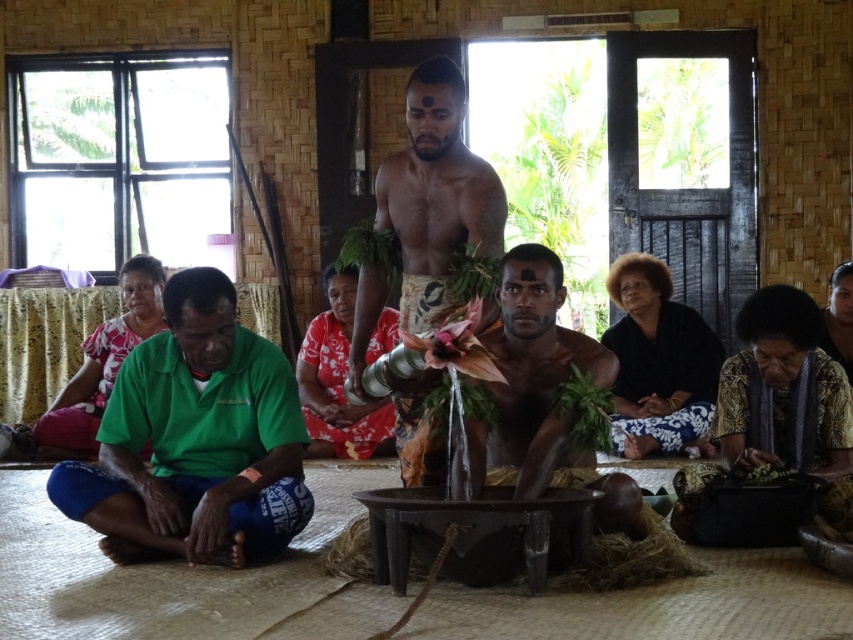
Is point (427, 97) positioned in front of point (787, 292)?

That is True.

Can you confirm if natural wood staff at center is thinner than printed fabric basket at lower right?

Yes.

You are a GUI agent. You are given a task and a screenshot of the screen. Output one action in this format:
    pyautogui.click(x=<x>, y=<y>)
    Task: Click on the natural wood staff at center
    Image resolution: width=853 pixels, height=640 pixels.
    Given the screenshot: What is the action you would take?
    pyautogui.click(x=436, y=195)

This screenshot has width=853, height=640. Find the location of `green fabric shirt at lower left`. green fabric shirt at lower left is located at coordinates (195, 440).

Can you confirm if green fabric shirt at lower left is positioned to the right of matte green shirt at lower left?

Correct, you'll find green fabric shirt at lower left to the right of matte green shirt at lower left.

Where is `green fabric shirt at lower left`? The width and height of the screenshot is (853, 640). green fabric shirt at lower left is located at coordinates (195, 440).

Which is below, green fabric shirt at lower left or brown woven cloth at center?

green fabric shirt at lower left is below.

Describe the element at coordinates (195, 440) in the screenshot. The height and width of the screenshot is (640, 853). I see `green fabric shirt at lower left` at that location.

In order to click on green fabric shirt at lower left in this screenshot , I will do `click(195, 440)`.